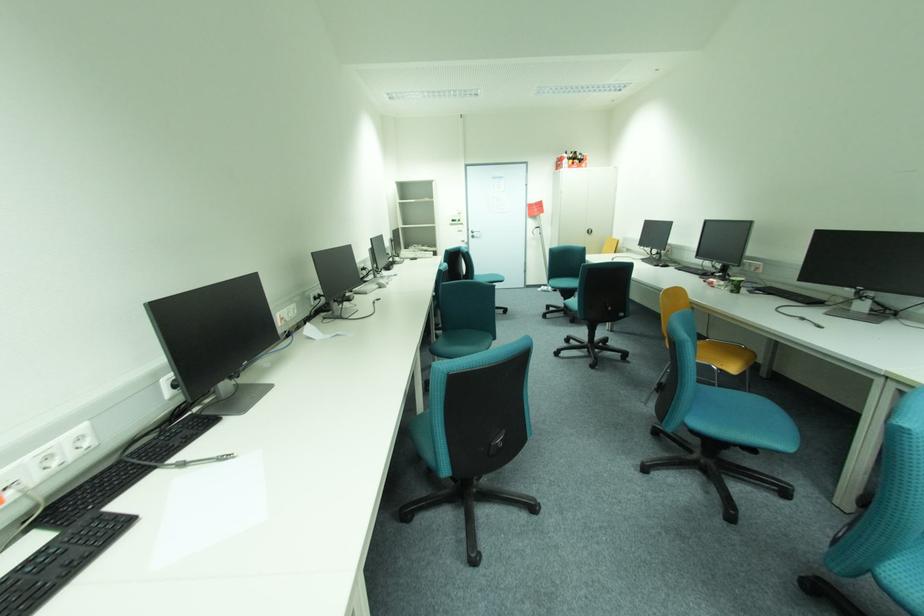
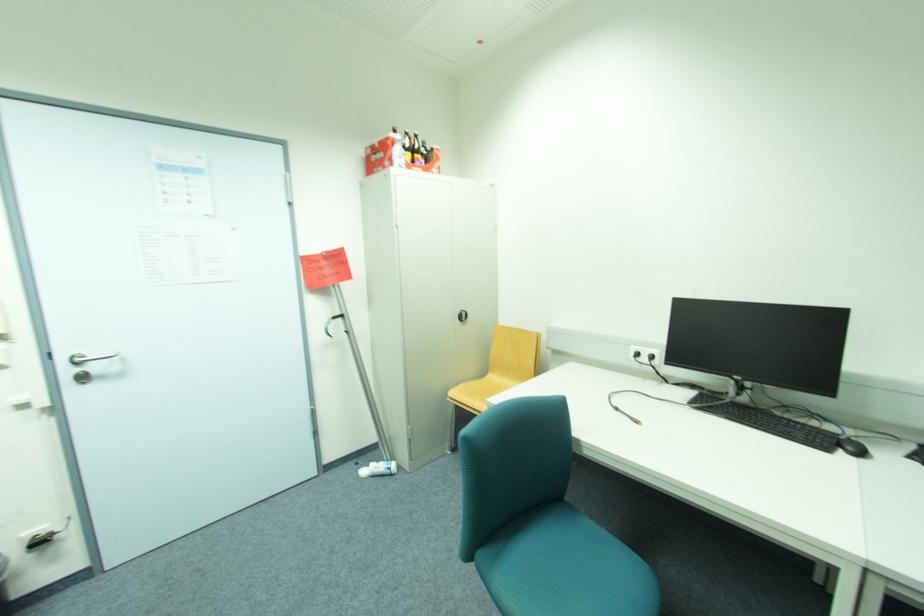
The point at [477,235] is marked in the first image. Where is the corresponding point in the second image?

(74, 371)